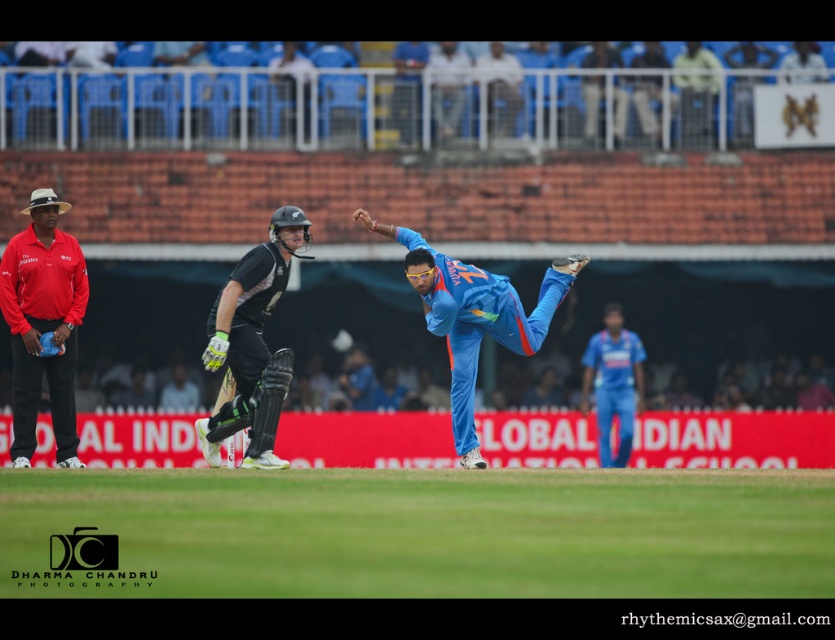
Can you confirm if red cotton shirt at left is positioned to the right of blue fabric cricket uniform at center?

In fact, red cotton shirt at left is to the left of blue fabric cricket uniform at center.

Which is behind, point (36, 365) or point (577, 262)?

The point (577, 262) is behind.

Who is more forward, (x=57, y=246) or (x=454, y=412)?

Point (x=57, y=246)

Identify the location of red cotton shirt at left. (43, 324).

Is black matte cricket bat at center wider than blue fabric cricket uniform at center?

Incorrect, black matte cricket bat at center's width does not surpass blue fabric cricket uniform at center's.

Between point (221, 346) and point (459, 268), which one is positioned in front?

Positioned in front is point (221, 346).

You are a GUI agent. You are given a task and a screenshot of the screen. Output one action in this format:
    pyautogui.click(x=<x>, y=<y>)
    Task: Click on the black matte cricket bat at center
    The height and width of the screenshot is (640, 835).
    Given the screenshot: What is the action you would take?
    pyautogui.click(x=252, y=342)

Is point (26, 317) positioned in front of point (271, 218)?

Yes, point (26, 317) is in front of point (271, 218).

Is point (29, 376) farther from camera compared to point (226, 417)?

Yes, point (29, 376) is behind point (226, 417).

The width and height of the screenshot is (835, 640). What do you see at coordinates (43, 324) in the screenshot? I see `red cotton shirt at left` at bounding box center [43, 324].

Find the location of a particular element. Image resolution: width=835 pixels, height=640 pixels. red cotton shirt at left is located at coordinates (43, 324).